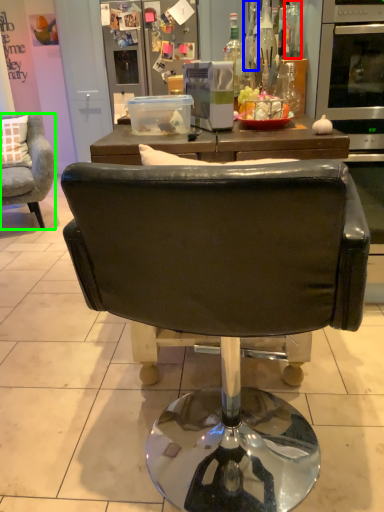
Question: Which object is the closest to the bottle (highlighted by a red box)? Choose among these: bottle (highlighted by a blue box) or chair (highlighted by a green box).

Choices:
 (A) bottle
 (B) chair

Answer: (A)